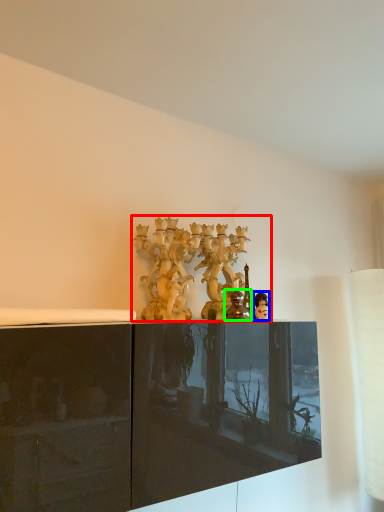
Question: Which object is positioned closest to collection (highlighted by a red box)? Select from person (highlighted by a blue box) and figurine (highlighted by a green box).

Choices:
 (A) person
 (B) figurine

Answer: (B)